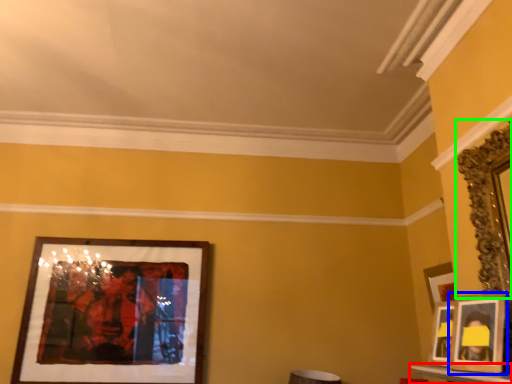
Question: Based on their relative distances, which object is nearer to table (highlighted by a red box)? Choose from picture frame (highlighted by a blue box) and picture frame (highlighted by a green box).

Choices:
 (A) picture frame
 (B) picture frame

Answer: (A)